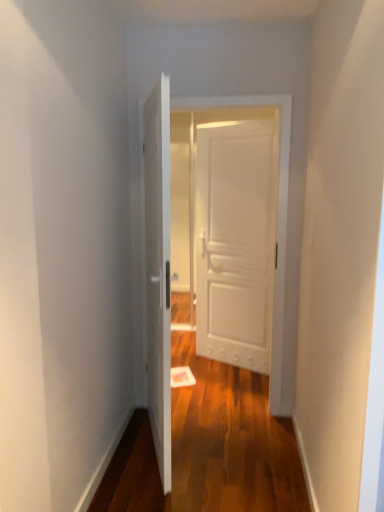
You are a GUI agent. You are given a task and a screenshot of the screen. Output one action in this format:
    pyautogui.click(x=<x>, y=<y>)
    Task: Click on the free space above white matte door at center, placed as the first door when sorted from back to front (from a real-world perspective)
    The width and height of the screenshot is (384, 512).
    Given the screenshot: What is the action you would take?
    pyautogui.click(x=239, y=118)